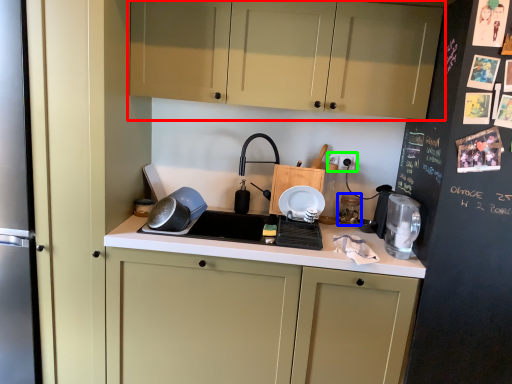
Question: Which object is positioned closest to cabinetry (highlighted by a red box)? Select from appliance (highlighted by a blue box) and electric outlet (highlighted by a green box).

Choices:
 (A) appliance
 (B) electric outlet

Answer: (B)